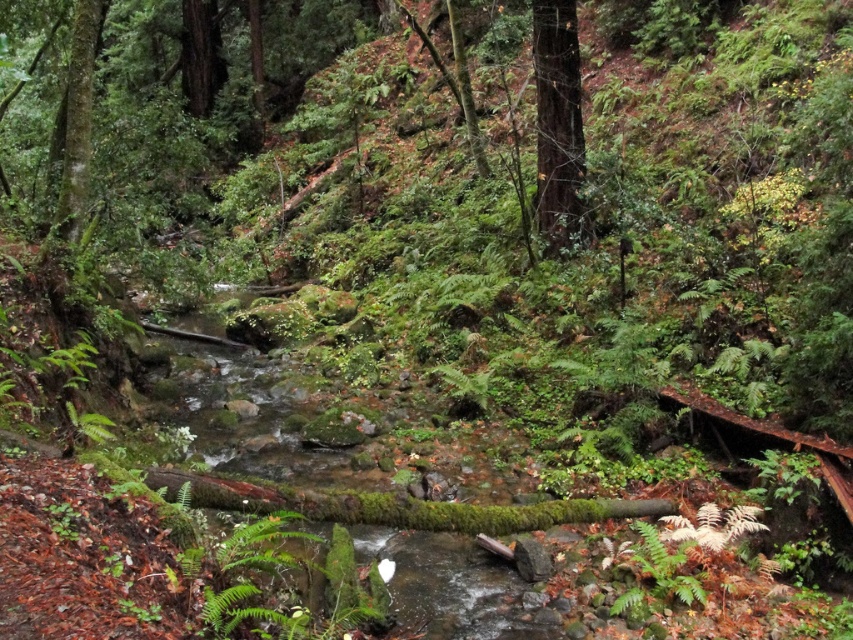
You are standing in the forest and want to walk from the green mossy tree at left to the green mossy tree at upper right. Which direction should you head?

You should head to the right because the green mossy tree at upper right is located to the right of the green mossy tree at left.